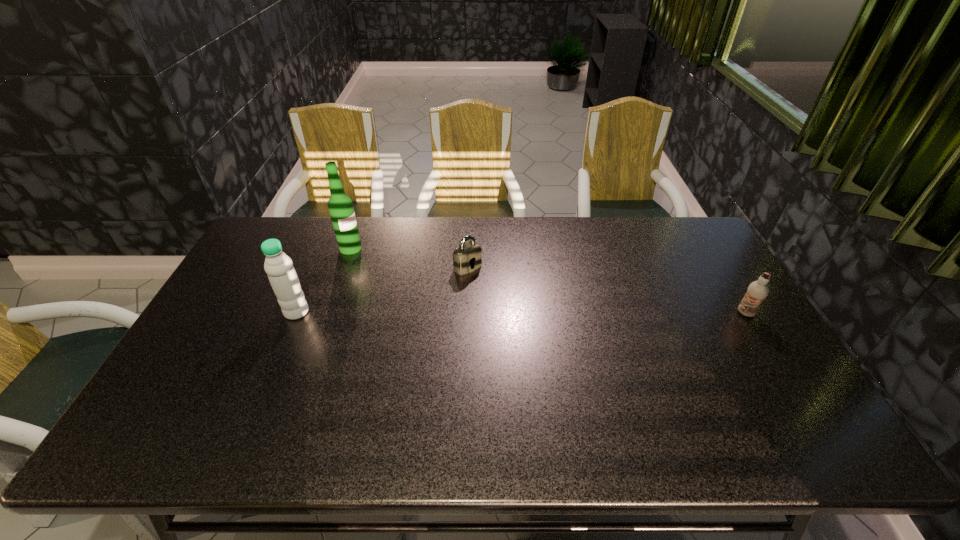
Locate an element on the screen. The image size is (960, 540). free point between the beer bottle and the water bottle is located at coordinates (324, 280).

Locate an element on the screen. The width and height of the screenshot is (960, 540). vacant area between the third shortest object and the shortest object is located at coordinates (382, 289).

At what (x,y) coordinates should I click in order to perform the action: click on vacant region between the third object from right to left and the second farthest object. Please return your answer as a coordinate pair (x, y). Image resolution: width=960 pixels, height=540 pixels. Looking at the image, I should click on (409, 258).

The width and height of the screenshot is (960, 540). I want to click on the second closest object relative to the rightmost object, so click(x=340, y=206).

Identify which object is the second closest to the second object from left to right. Please provide its 2D coordinates. Your answer should be formatted as a tuple, i.e. [(x, y)], where the tuple contains the x and y coordinates of a point satisfying the conditions above.

[(467, 257)]

Where is `blank space that satisfies the following two spatial constraints: 1. on the back side of the beer bottle; 2. on the left side of the water bottle`? blank space that satisfies the following two spatial constraints: 1. on the back side of the beer bottle; 2. on the left side of the water bottle is located at coordinates (324, 248).

You are a GUI agent. You are given a task and a screenshot of the screen. Output one action in this format:
    pyautogui.click(x=<x>, y=<y>)
    Task: Click on the vacant space that satisfies the following two spatial constraints: 1. on the back side of the farthest object; 2. on the right side of the water bottle
    
    Given the screenshot: What is the action you would take?
    pyautogui.click(x=324, y=248)